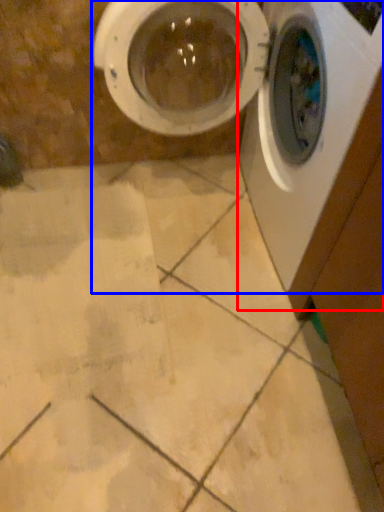
Question: Among these objects, which one is farthest to the camera, washing machine (highlighted by a red box) or washing machine (highlighted by a blue box)?

Choices:
 (A) washing machine
 (B) washing machine

Answer: (B)